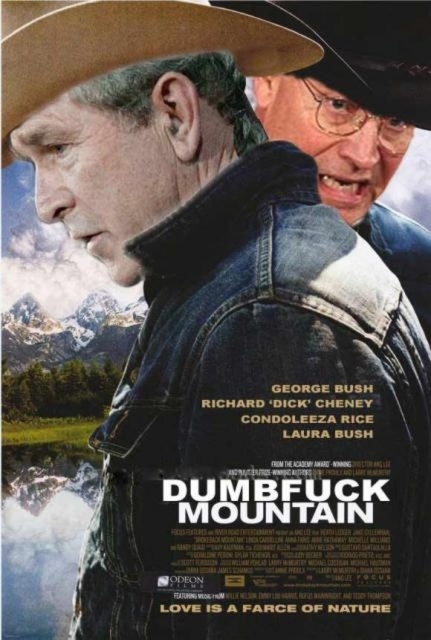
You are a costume designer looking at the movie poster for Dumbfuck Mountain. You need to determine the spatial relationship between the denim jacket at center and the brown leather cowboy hat at upper center. Which object is located to the left of the other?

The denim jacket at center is positioned on the left side of brown leather cowboy hat at upper center, so the denim jacket at center is to the left of the brown leather cowboy hat at upper center.

You are an actor in a movie scene and need to grab the brown felt cowboy hat at upper left from where you are standing in front of the denim jacket at center. Can you reach it without moving your feet?

The denim jacket at center is closer to the viewer than brown felt cowboy hat at upper left, so the brown felt cowboy hat at upper left is further away. You might need to move closer to reach it.